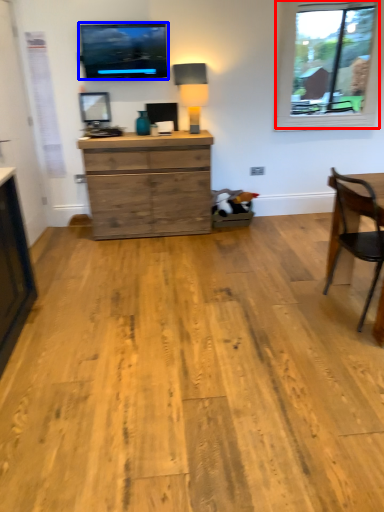
Question: Among these objects, which one is farthest to the camera, window (highlighted by a red box) or television (highlighted by a blue box)?

Choices:
 (A) window
 (B) television

Answer: (A)